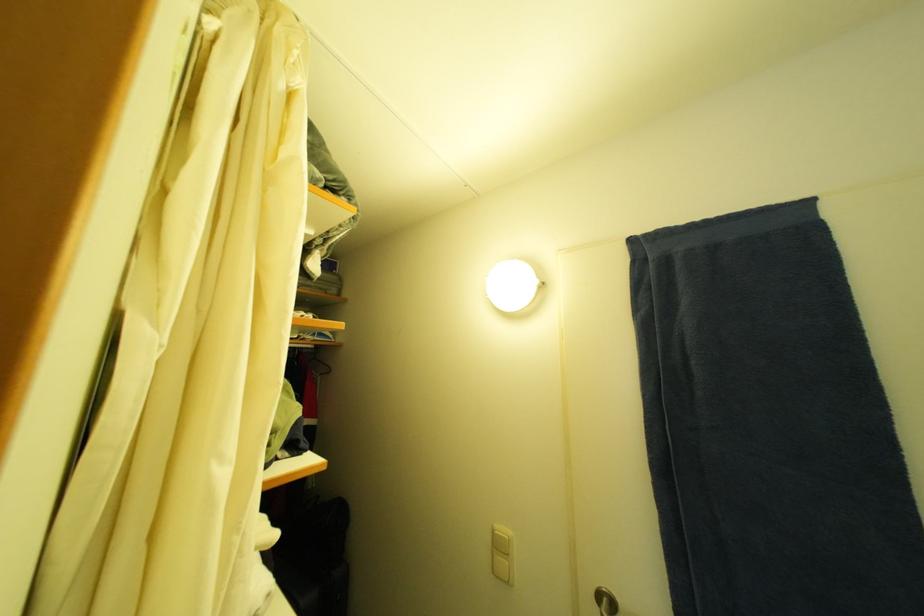
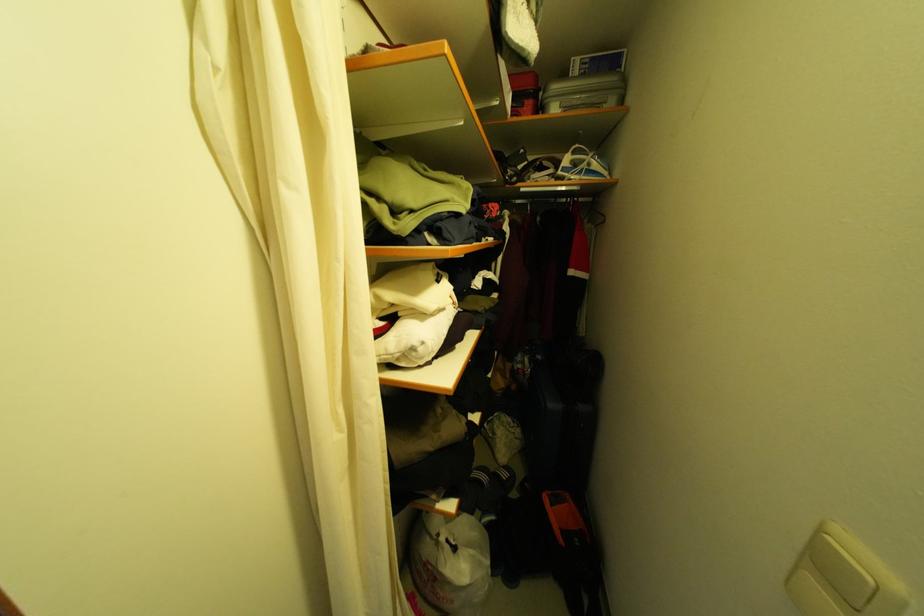
The images are taken continuously from a first-person perspective. In which direction is your viewpoint rotating?

The camera rotated toward left-down.